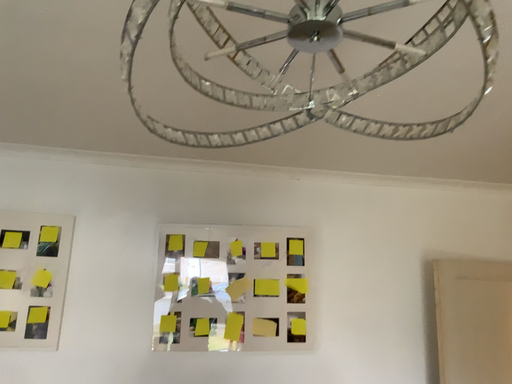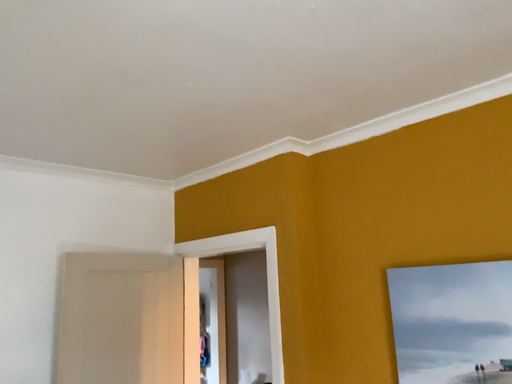
Question: How did the camera likely rotate when shooting the video?

Choices:
 (A) rotated left
 (B) rotated right

Answer: (B)